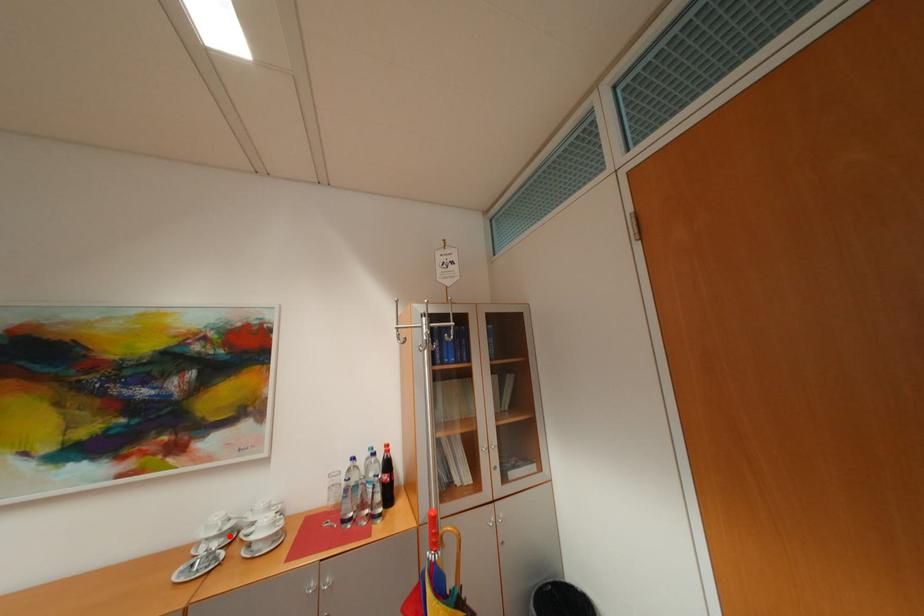
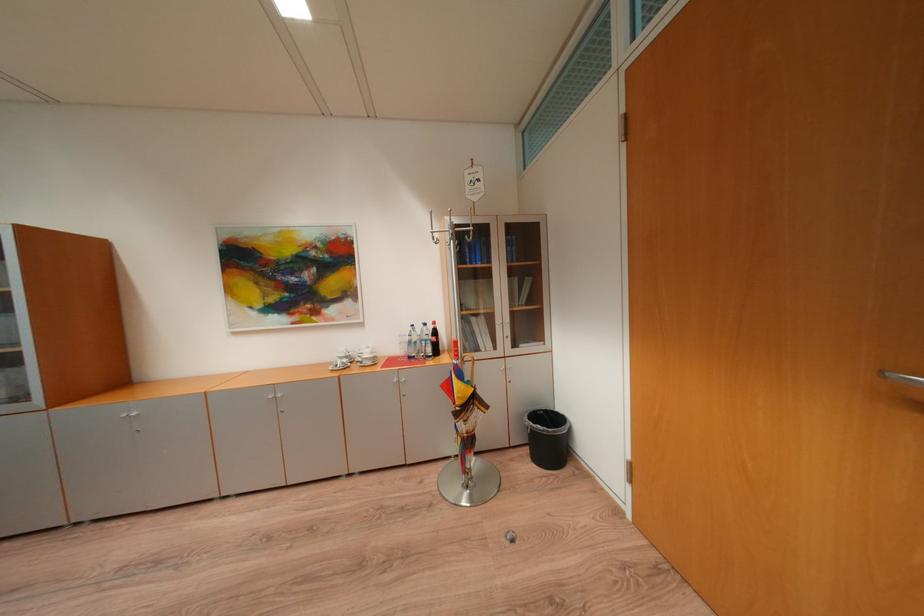
In the second image, find the point that corresponds to the highlighted location in the first image.

(355, 359)